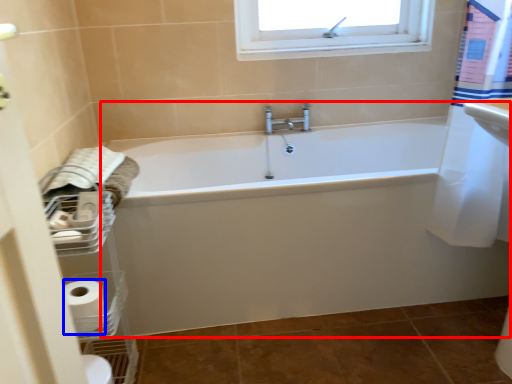
Question: Which point is closer to the camera, bathtub (highlighted by a red box) or toilet paper (highlighted by a blue box)?

Choices:
 (A) bathtub
 (B) toilet paper

Answer: (B)